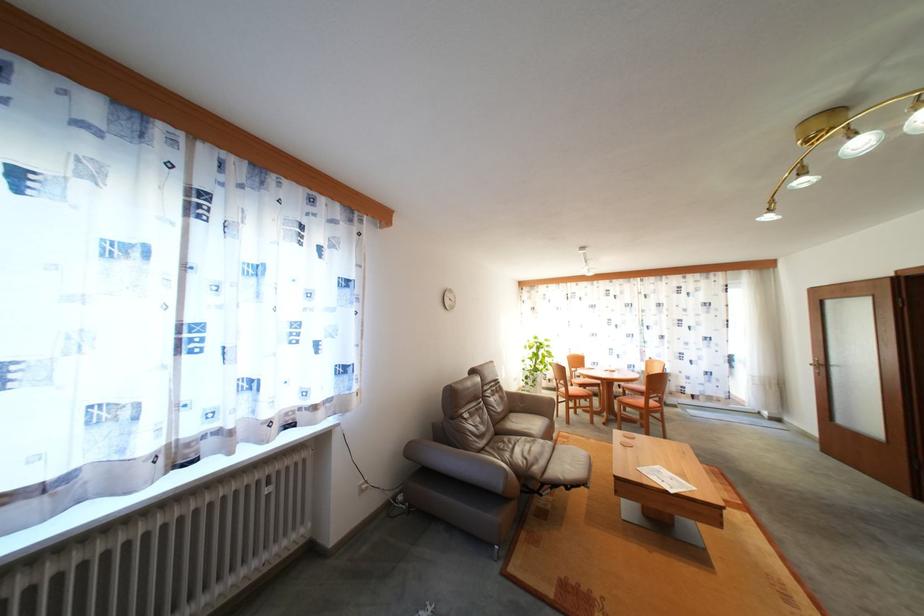
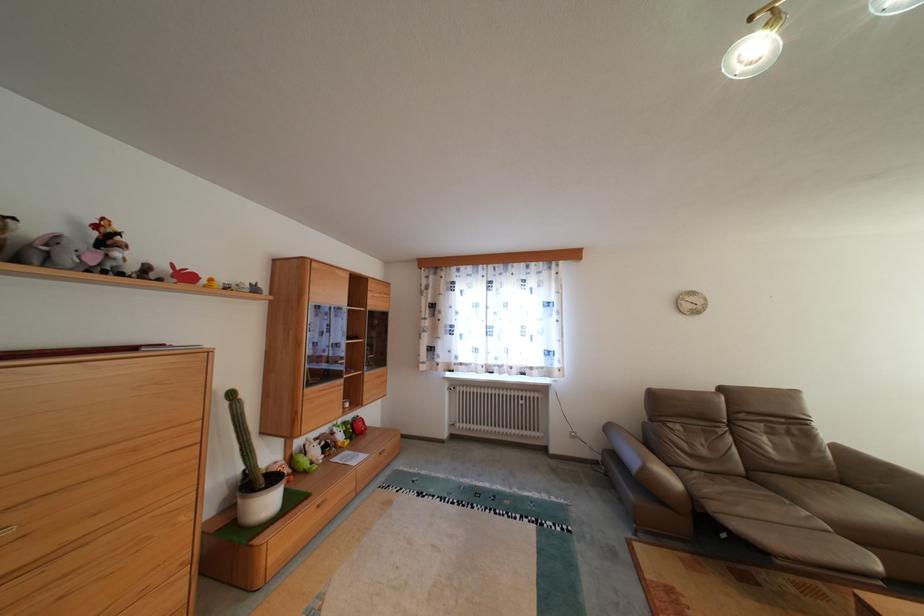
Find the pixel in the second image that matches [521,411] in the first image.

(854, 483)